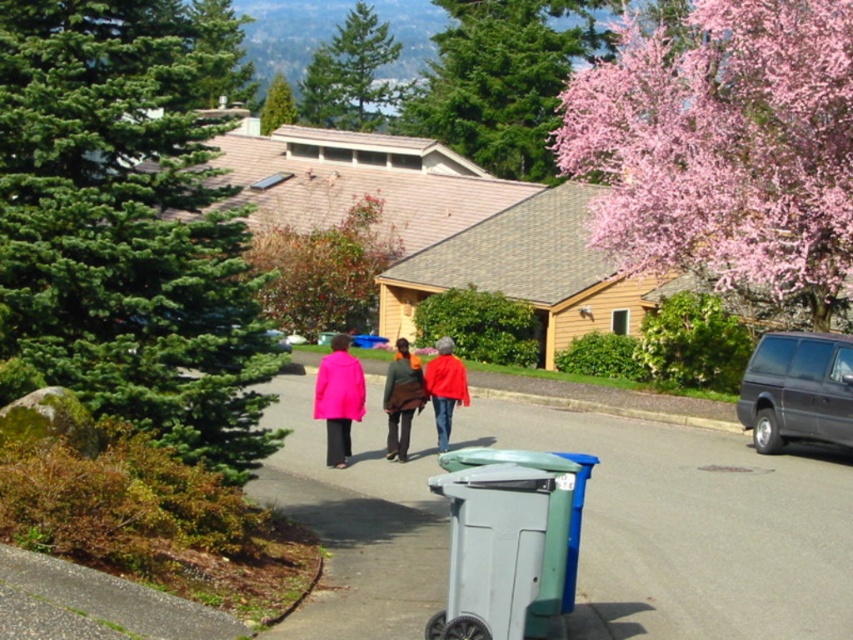
Based on the photo, you are standing at the entrance of the house and want to place a new trash bag into the gray plastic trash can at lower center. To do this, you need to walk around the pink blossoming tree at upper right. Is the trash can located to the left or right side of the tree?

The gray plastic trash can at lower center is located to the left of the pink blossoming tree at upper right, so you would need to walk around the tree to the left side to reach it.

You are standing at point (350, 74) in the suburban residential area. What object is located exactly at your current position?

The green textured pine tree at upper center is located exactly at point (350, 74).

You are standing at the camera position and want to walk to the green textured pine tree at upper center. How far will you have to walk?

The green textured pine tree at upper center is 90.19 meters away from the camera, so you will have to walk 90.19 meters to reach it.